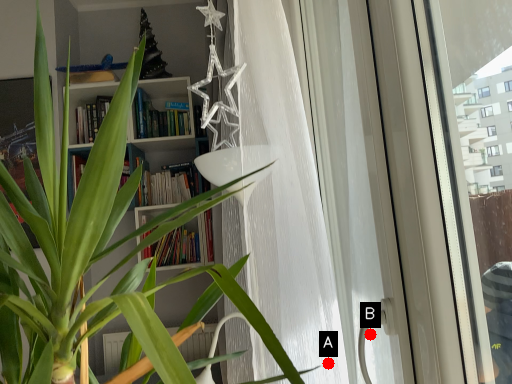
Question: Two points are circled on the image, labeled by A and B beside each circle. Among these points, which one is farthest from the camera?

Choices:
 (A) A is further
 (B) B is further

Answer: (A)